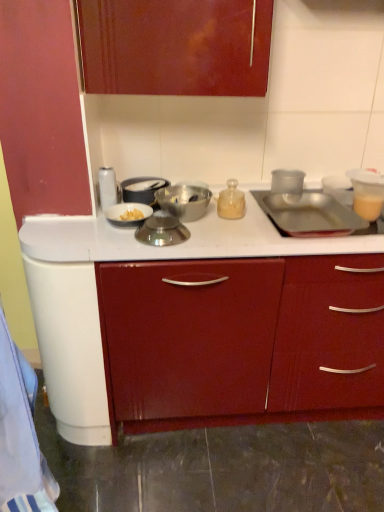
Find the location of a particular element. This screenshot has width=384, height=512. free spot to the right of shiny metallic bowl at center, which is the 4th kitchen appliance from left to right is located at coordinates (220, 243).